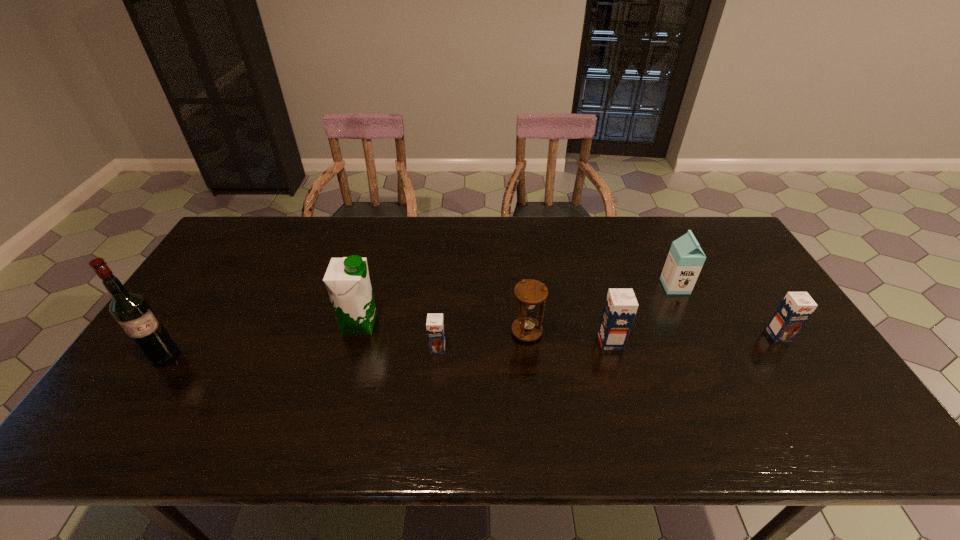
Image resolution: width=960 pixels, height=540 pixels. Identify the location of the third object from left to right. (435, 323).

The height and width of the screenshot is (540, 960). Find the location of `the shortest chocolate milk`. the shortest chocolate milk is located at coordinates (435, 323).

Identify the location of the fifth object from left to right. (620, 308).

Identify the location of the second chocolate milk from left to right. (620, 308).

I want to click on the rightmost object, so click(796, 308).

Locate an element on the screen. The width and height of the screenshot is (960, 540). the second tallest chocolate milk is located at coordinates (796, 308).

Locate an element on the screen. Image resolution: width=960 pixels, height=540 pixels. the farthest object is located at coordinates click(685, 260).

You are a GUI agent. You are given a task and a screenshot of the screen. Output one action in this format:
    pyautogui.click(x=<x>, y=<y>)
    Task: Click on the sixth object from left to right
    
    Given the screenshot: What is the action you would take?
    pyautogui.click(x=685, y=260)

Locate an element on the screen. The width and height of the screenshot is (960, 540). the sixth shortest object is located at coordinates (347, 280).

You are a GUI agent. You are given a task and a screenshot of the screen. Output one action in this format:
    pyautogui.click(x=<x>, y=<y>)
    Task: Click on the second object from left to right
    The width and height of the screenshot is (960, 540).
    Given the screenshot: What is the action you would take?
    pyautogui.click(x=347, y=280)